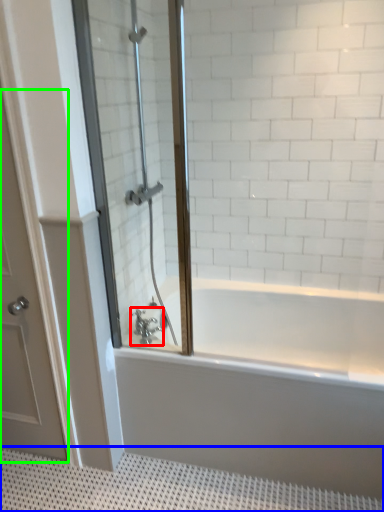
Question: Considering the real-world distances, which object is closest to tap (highlighted by a red box)? bath mat (highlighted by a blue box) or door (highlighted by a green box).

Choices:
 (A) bath mat
 (B) door

Answer: (B)